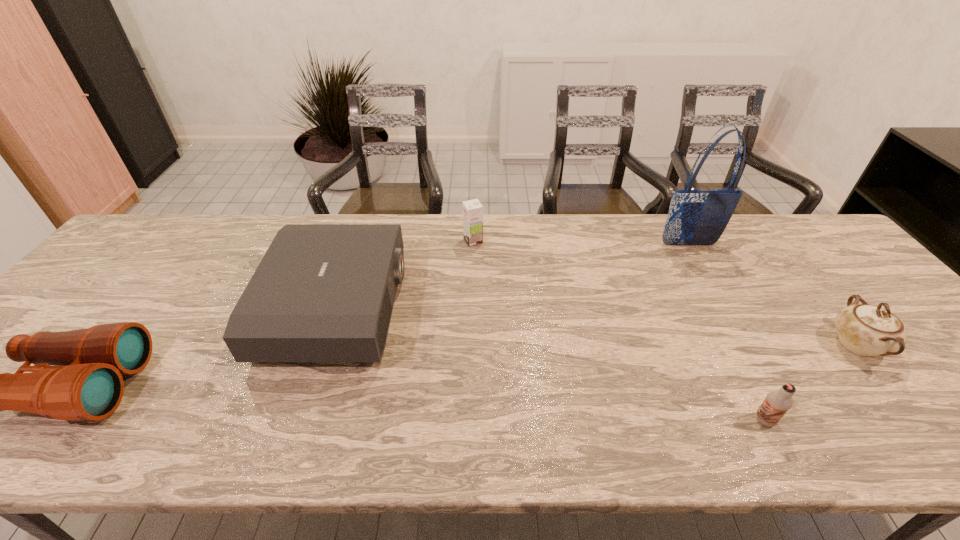
Identify the location of vacant region located 0.230m on the left of the chinaware. (733, 344).

I want to click on free space located on the left of the nearer chocolate milk, so click(686, 420).

Locate an element on the screen. This screenshot has width=960, height=540. shopping bag positioned at the far edge is located at coordinates (695, 217).

Where is `chocolate milk that is at the far edge`? This screenshot has height=540, width=960. chocolate milk that is at the far edge is located at coordinates (472, 209).

Locate an element on the screen. The height and width of the screenshot is (540, 960). projector at the far edge is located at coordinates (322, 292).

The width and height of the screenshot is (960, 540). Find the location of `object at the near edge`. object at the near edge is located at coordinates (778, 402).

The height and width of the screenshot is (540, 960). Find the location of `object present at the right edge`. object present at the right edge is located at coordinates (867, 330).

This screenshot has height=540, width=960. In the image, there is a desktop. In order to click on vacant space at the far edge in this screenshot , I will do `click(750, 214)`.

Find the location of `vacant space at the near edge`. vacant space at the near edge is located at coordinates (887, 428).

Where is `free location at the left edge`? The width and height of the screenshot is (960, 540). free location at the left edge is located at coordinates (139, 287).